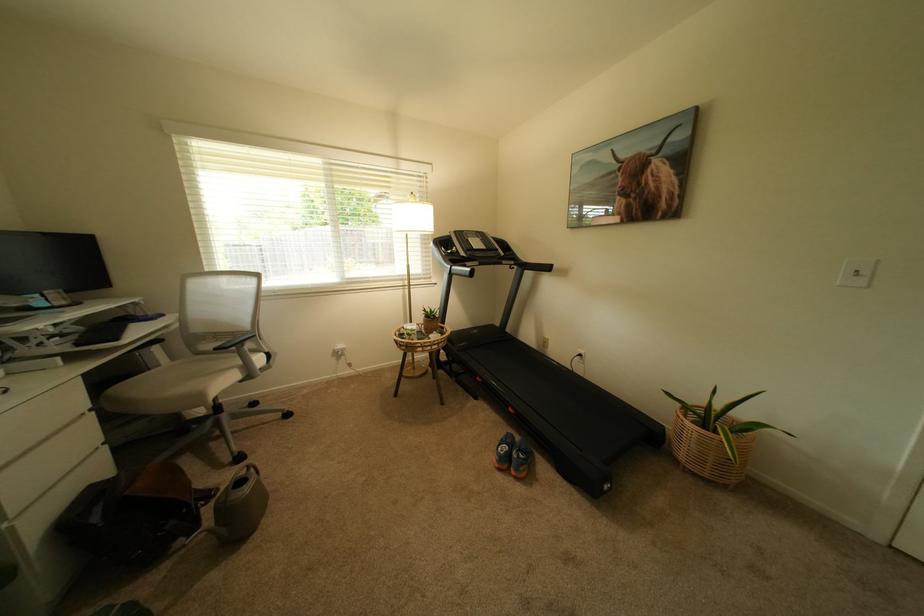
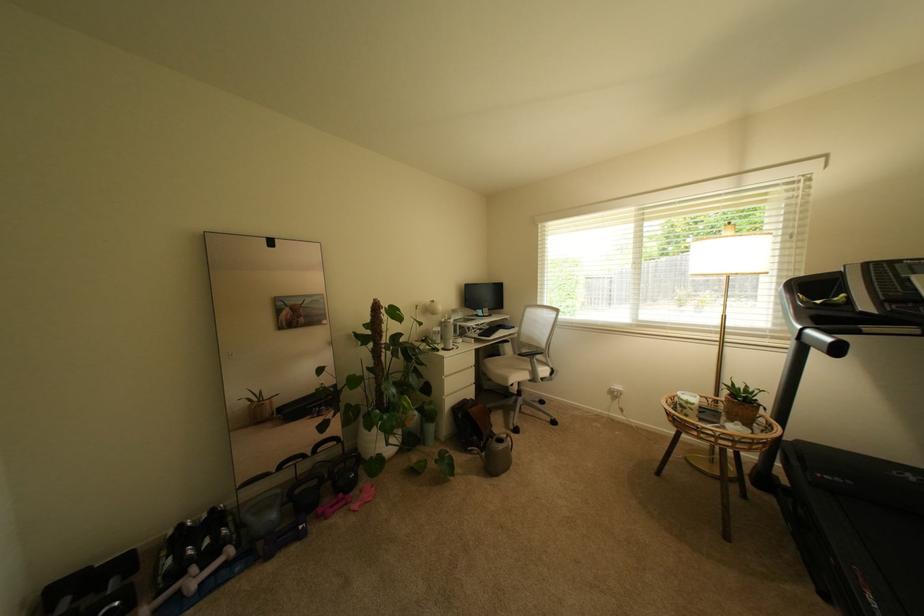
Locate, in the second image, the point that corresponds to point 345,349 in the first image.

(622, 389)